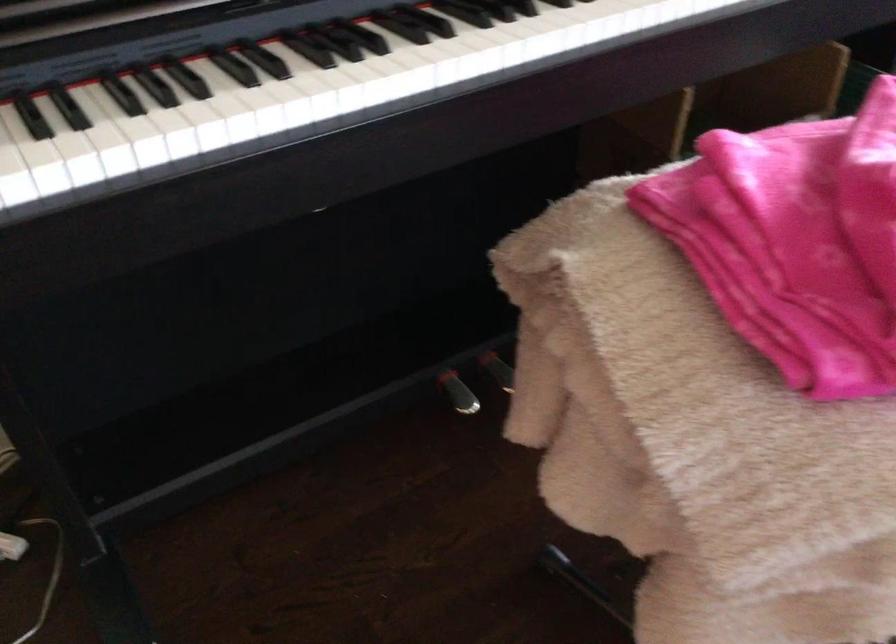
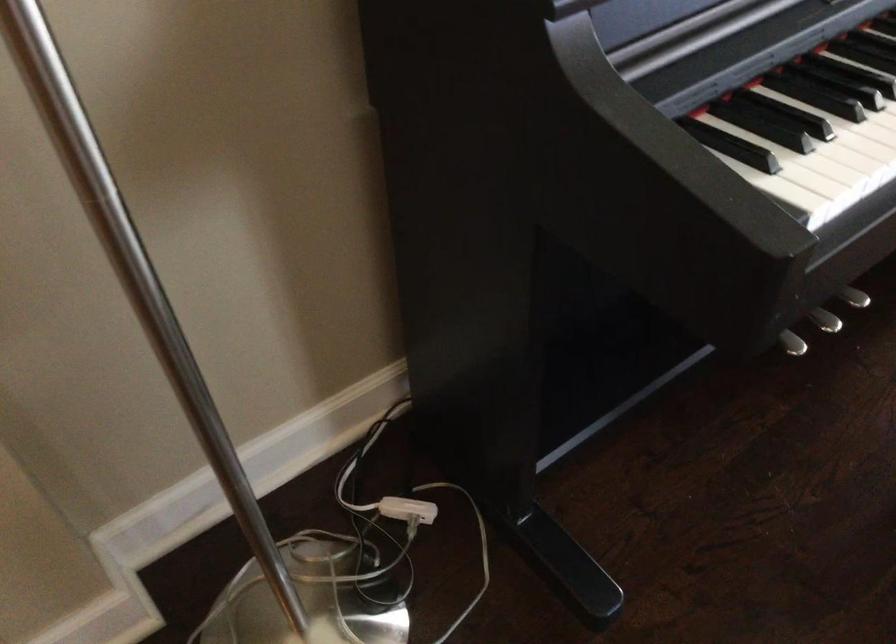
Find the pixel in the second image that matches the point at 455,404 in the first image.

(791, 343)